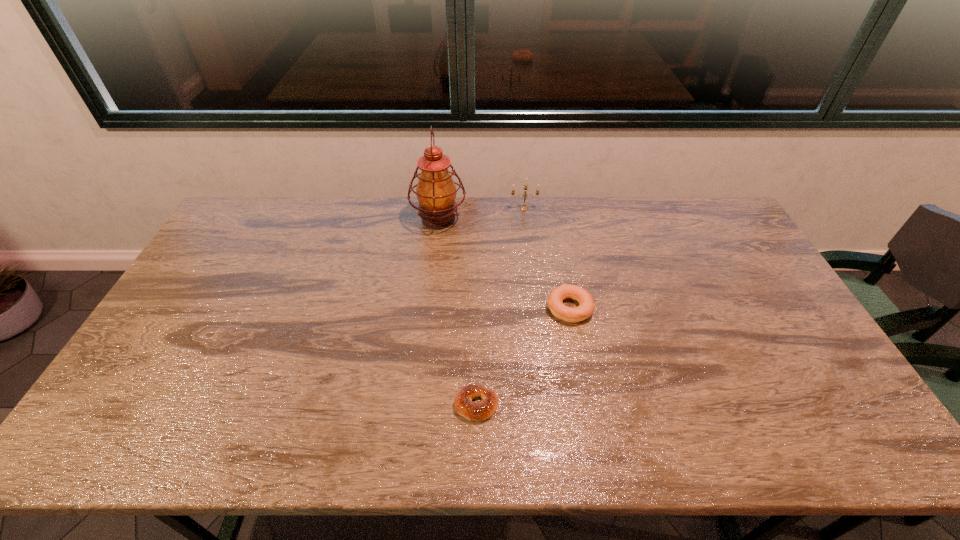
Find the location of a particular element. This screenshot has width=960, height=540. the tallest object is located at coordinates (436, 192).

Where is `candle`? This screenshot has width=960, height=540. candle is located at coordinates (523, 208).

Identify the location of the taller bagel. (586, 307).

The image size is (960, 540). What are the coordinates of `the right bagel` in the screenshot? It's located at (586, 307).

Identify the location of the nearer bagel. The height and width of the screenshot is (540, 960). (463, 404).

Identify the location of the nearest object. The image size is (960, 540). (463, 404).

At what (x,y) coordinates should I click in order to perform the action: click on vacant point located on the front of the tallest object. Please return your answer as a coordinate pair (x, y). Looking at the image, I should click on (435, 251).

The image size is (960, 540). Identify the location of vacant space located 0.260m on the right of the candle. (608, 208).

In order to click on free space located on the left of the right bagel in this screenshot , I will do `click(506, 308)`.

The height and width of the screenshot is (540, 960). I want to click on free space located 0.280m on the right of the shortest object, so click(612, 405).